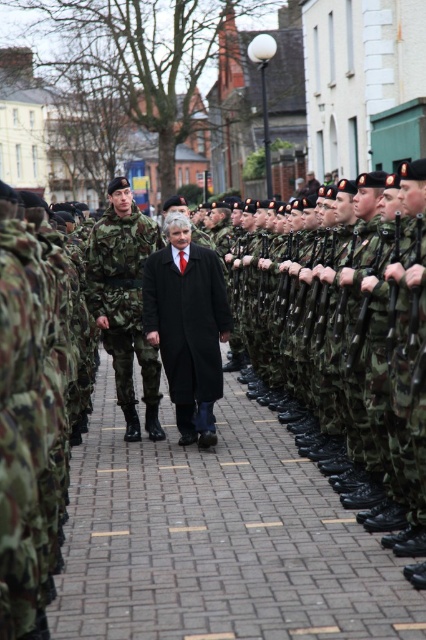
You are a photographer positioned at the back of the soldiers. You want to take a clear photo of the black wool coat at center without the brick pavement at center blocking the view. Is this possible?

Result: The brick pavement at center is in front of the black wool coat at center, so taking a clear photo of the black wool coat at center without the brick pavement at center blocking the view is not possible as the pavement is obstructing the direct line of sight.

You are a soldier in the line. Your rifle is 1.2 meters long. Can you hold your rifle vertically without it touching the brick pavement at center between you and the next soldier?

The distance between you and the next soldier is 7.14 meters, which is much wider than the rifle length of 1.2 meters. Therefore, you can hold your rifle vertically without it touching the brick pavement at center between you and the next soldier.

You are a photographer positioned behind the soldiers in the military parade scene. You want to capture a photo that includes both the brick pavement at center and the black wool coat at center. Which object will appear wider in the photo?

The black wool coat at center will appear wider in the photo because it is wider than the brick pavement at center.